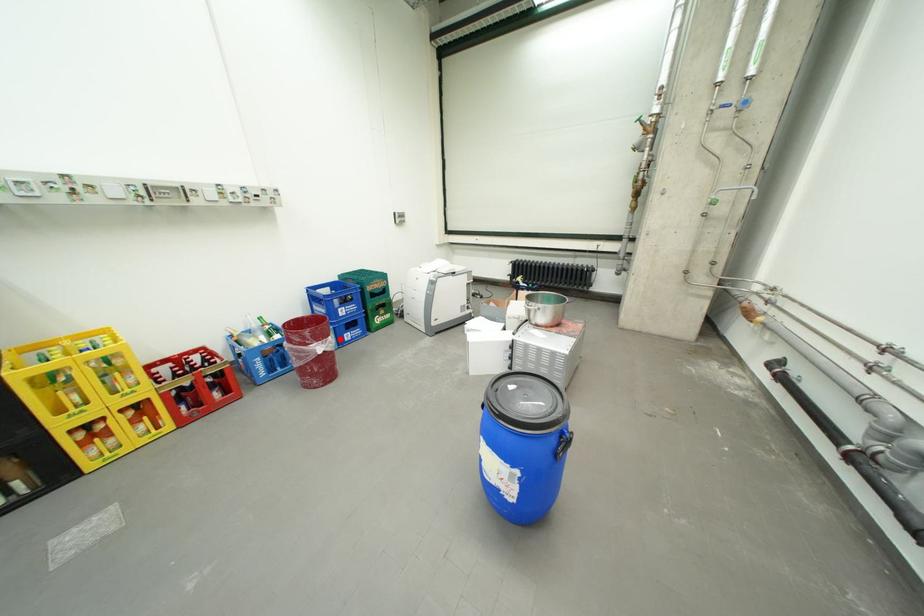
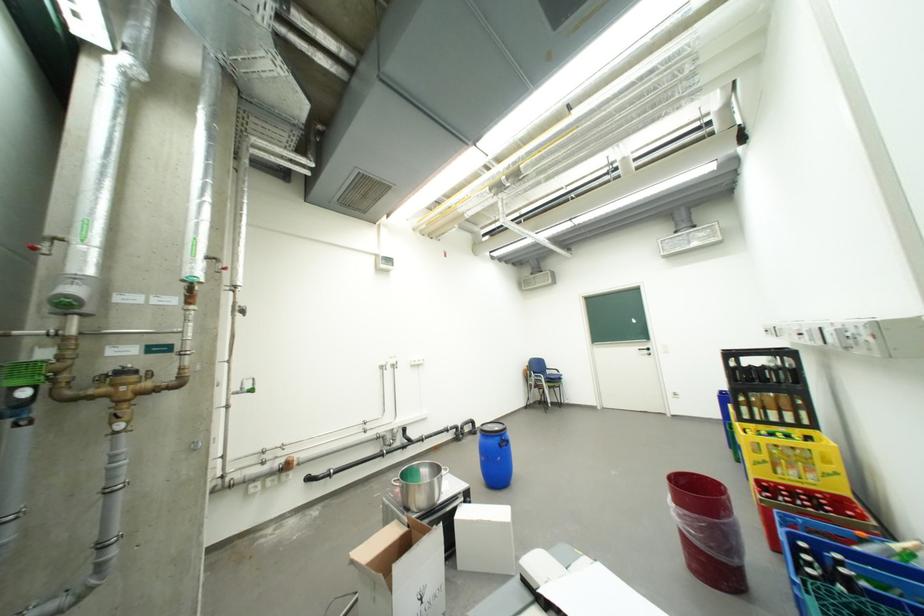
Question: I am providing you with two images of the same scene from different viewpoints. Given a red point in image1, look at the same physical point in image2. Is it:

Choices:
 (A) Closer to the viewpoint
 (B) Farther from the viewpoint

Answer: (B)